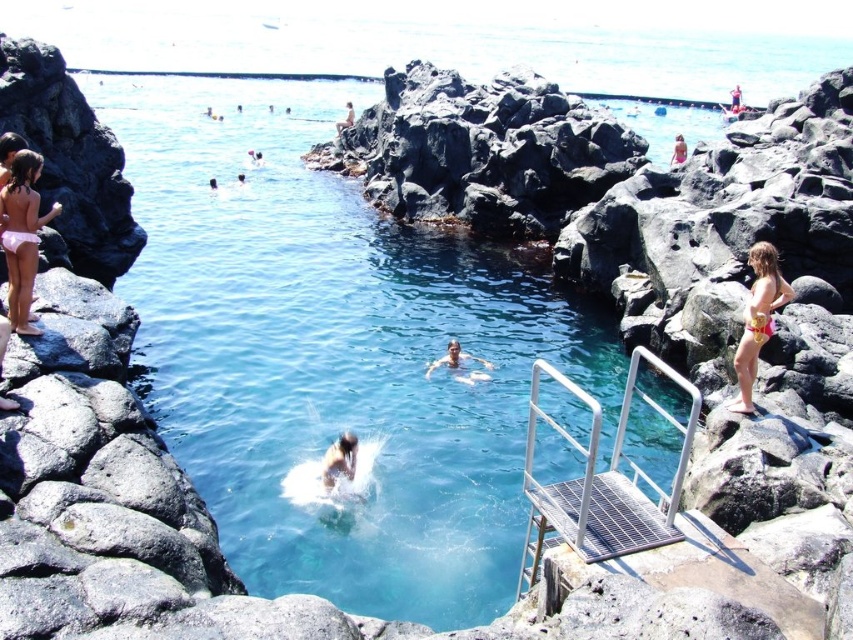
Is the position of pink fabric bikini at left less distant than that of transparent plastic pool at upper center?

Yes.

Which is more to the left, pink fabric bikini at left or transparent plastic pool at upper center?

pink fabric bikini at left is more to the left.

Is point (22, 224) farther from viewer compared to point (670, 100)?

No, (22, 224) is in front of (670, 100).

The width and height of the screenshot is (853, 640). I want to click on pink fabric bikini at left, so click(22, 236).

Does point (328, 456) lie behind point (463, 356)?

No, it is not.

Does smooth brown hair at center lie behind smooth skin person at center?

That is False.

The height and width of the screenshot is (640, 853). Find the location of `smooth brown hair at center`. smooth brown hair at center is located at coordinates (339, 460).

Is silver metallic ladder at right thinner than transparent plastic pool at upper center?

Indeed, silver metallic ladder at right has a lesser width compared to transparent plastic pool at upper center.

Can you confirm if silver metallic ladder at right is smaller than transparent plastic pool at upper center?

Yes.

The image size is (853, 640). Describe the element at coordinates (602, 481) in the screenshot. I see `silver metallic ladder at right` at that location.

Find the location of a particular element. The height and width of the screenshot is (640, 853). silver metallic ladder at right is located at coordinates (602, 481).